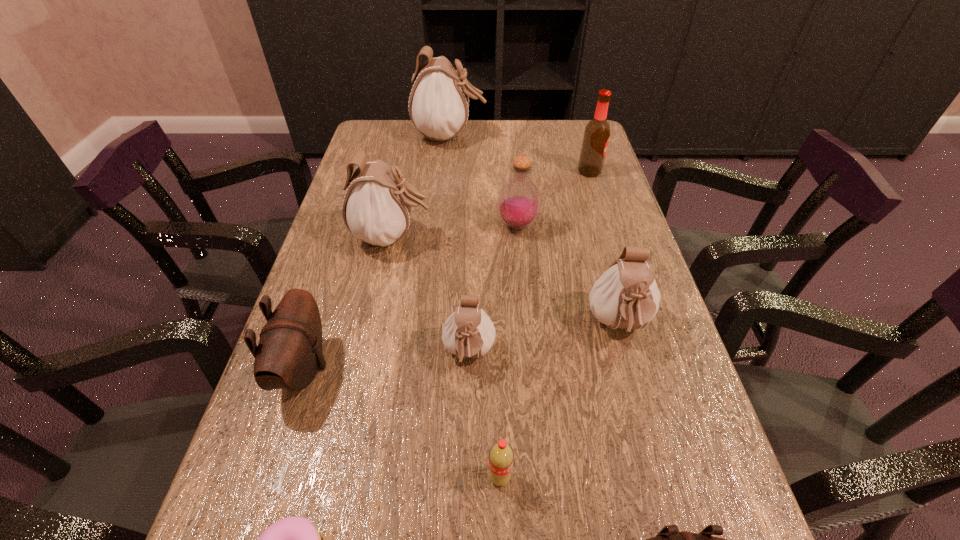
Where is `object present at the far edge`? The width and height of the screenshot is (960, 540). object present at the far edge is located at coordinates (438, 106).

In order to click on beer bottle at the right edge in this screenshot , I will do `click(596, 136)`.

You are a GUI agent. You are given a task and a screenshot of the screen. Output one action in this format:
    pyautogui.click(x=<x>, y=<y>)
    Task: Click on the pouch that is at the right edge
    The width and height of the screenshot is (960, 540).
    Given the screenshot: What is the action you would take?
    pyautogui.click(x=626, y=296)

Identify the location of free point at the far edge. (547, 145).

I want to click on free space at the left edge of the desktop, so click(231, 502).

This screenshot has width=960, height=540. In the image, there is a desktop. In order to click on vacant space at the right edge in this screenshot , I will do `click(618, 225)`.

At what (x,y) coordinates should I click in order to perform the action: click on free space at the far right corner of the desktop. Please return your answer as a coordinate pair (x, y). Looking at the image, I should click on (579, 143).

You are a GUI agent. You are given a task and a screenshot of the screen. Output one action in this format:
    pyautogui.click(x=<x>, y=<y>)
    Task: Click on the vacant point located between the bottle and the rightmost white pouch
    The height and width of the screenshot is (540, 960).
    Given the screenshot: What is the action you would take?
    pyautogui.click(x=568, y=275)

Find the location of a particular element. This screenshot has width=960, height=540. free space between the farthest white pouch and the farther brown pouch is located at coordinates (376, 252).

Where is `vacant point located between the left brown pouch and the third smallest white pouch`? vacant point located between the left brown pouch and the third smallest white pouch is located at coordinates (348, 302).